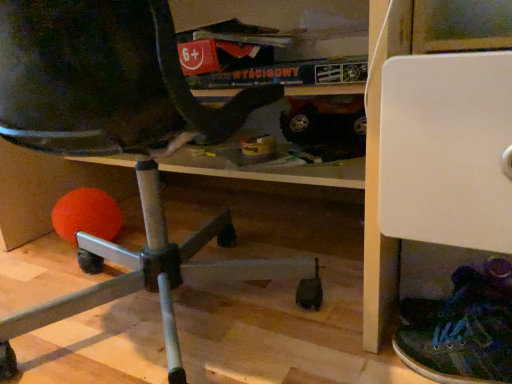
At what (x,y) coordinates should I click in order to perform the action: click on metallic gray chair at lower left. Please return your answer as a coordinate pair (x, y). This screenshot has height=384, width=512. Looking at the image, I should click on (121, 143).

The height and width of the screenshot is (384, 512). What do you see at coordinates (121, 143) in the screenshot?
I see `metallic gray chair at lower left` at bounding box center [121, 143].

Measure the distance between metallic gray chair at lower left and camera.

49.19 centimeters.

Locate an element on the screen. metallic gray chair at lower left is located at coordinates (121, 143).